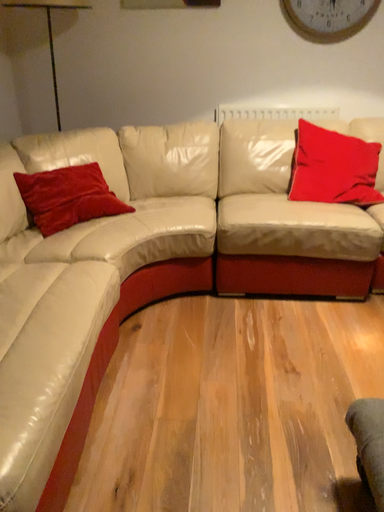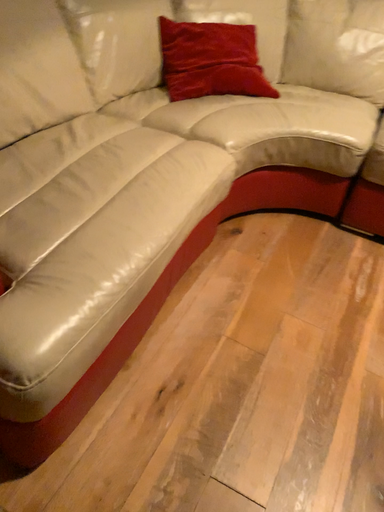
Question: Which way did the camera rotate in the video?

Choices:
 (A) rotated upward
 (B) rotated downward

Answer: (B)